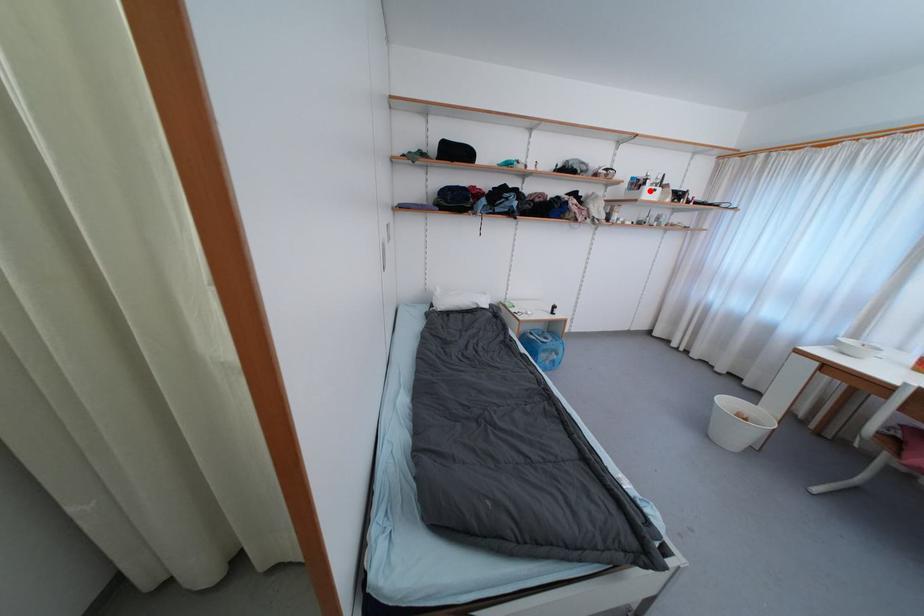
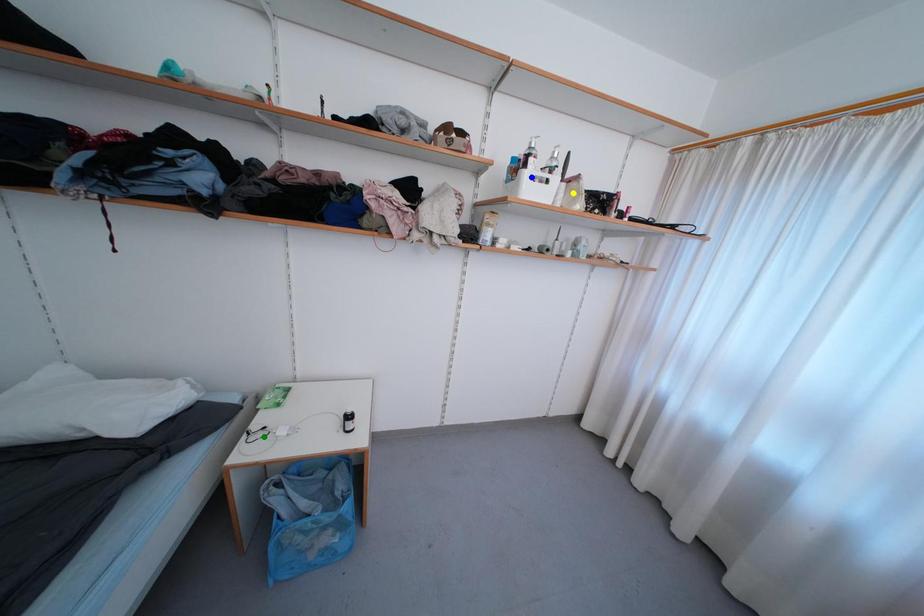
Question: I am providing you with two images of the same scene from different viewpoints. A red point is marked on the first image. You are given multiple points on the second image. Can you choose the point in image 2 that corresponds to the point in image 1?

Choices:
 (A) blue point
 (B) green point
 (C) yellow point

Answer: (A)